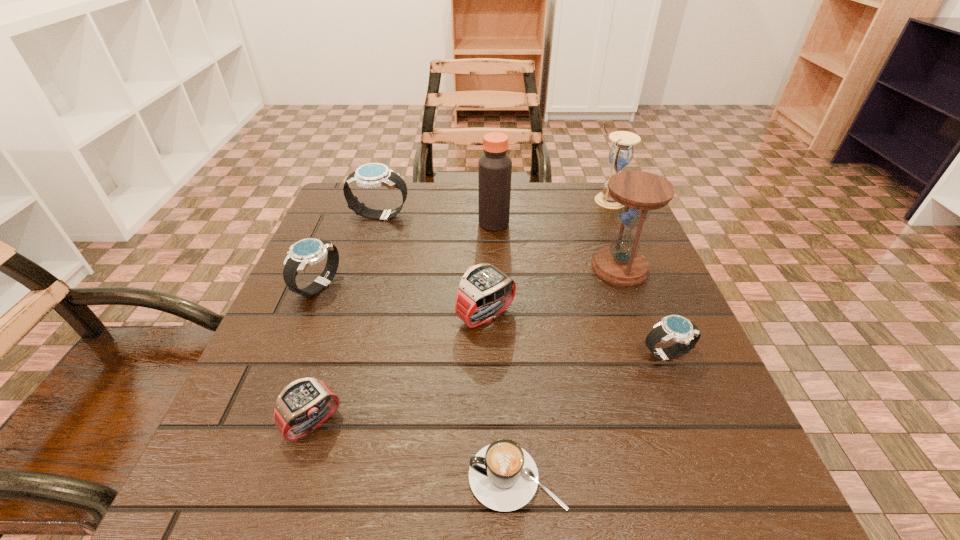
Select which silver watch appears as the third closest to the nearer hourglass. Please provide its 2D coordinates. Your answer should be formatted as a tuple, i.e. [(x, y)], where the tuple contains the x and y coordinates of a point satisfying the conditions above.

[(306, 252)]

You are a GUI agent. You are given a task and a screenshot of the screen. Output one action in this format:
    pyautogui.click(x=<x>, y=<y>)
    Task: Click on the second closest silver watch to the smallest silver watch
    Image resolution: width=960 pixels, height=540 pixels.
    Given the screenshot: What is the action you would take?
    pyautogui.click(x=373, y=175)

Find the location of `free space in the image that satisfies the following two spatial constraints: 1. on the back side of the nearer hourglass; 2. on the left side of the white hourglass`. free space in the image that satisfies the following two spatial constraints: 1. on the back side of the nearer hourglass; 2. on the left side of the white hourglass is located at coordinates (595, 200).

I want to click on free point that satisfies the following two spatial constraints: 1. on the front side of the white hourglass; 2. with the handle on the side of the black cappuccino, so click(726, 477).